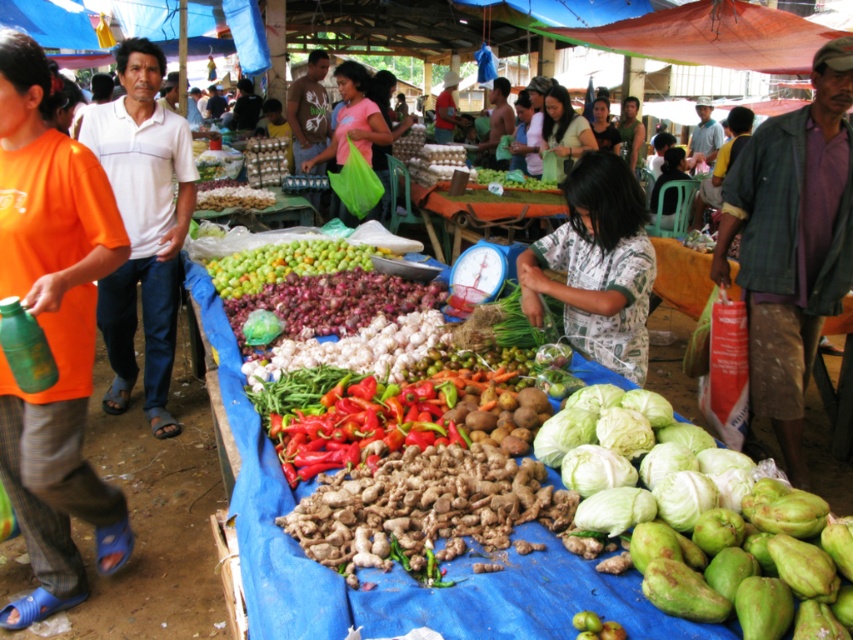
Does white printed shirt at center appear on the left side of pink fabric bag at center?

Incorrect, white printed shirt at center is not on the left side of pink fabric bag at center.

From the picture: Who is more distant from viewer, (589, 339) or (363, 125)?

Positioned behind is point (363, 125).

Does point (572, 170) lie in front of point (375, 129)?

Yes, point (572, 170) is in front of point (375, 129).

What are the coordinates of `white printed shirt at center` in the screenshot? It's located at (596, 266).

Does green rough guava at center lie behind matte black shirt at center?

No, it is in front of matte black shirt at center.

Who is more distant from viewer, (x=715, y=518) or (x=606, y=148)?

Positioned behind is point (x=606, y=148).

This screenshot has height=640, width=853. What do you see at coordinates (738, 579) in the screenshot?
I see `green rough guava at center` at bounding box center [738, 579].

Identify the location of green rough guava at center. The image size is (853, 640). (738, 579).

Does orange fabric shirt at left have a larger size compared to white printed shirt at center?

Yes, orange fabric shirt at left is bigger than white printed shirt at center.

Does point (38, 214) lie behind point (605, 362)?

No, it is not.

Where is `orange fabric shirt at left`? The width and height of the screenshot is (853, 640). orange fabric shirt at left is located at coordinates (51, 332).